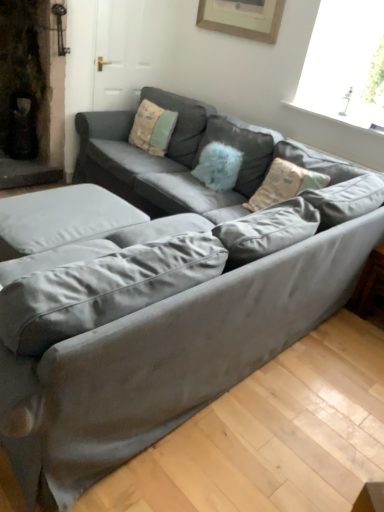
Question: Does satin gray couch at center lie in front of velvet beige pillow at center, which is counted as the 1th pillow, starting from the left?

Choices:
 (A) no
 (B) yes

Answer: (B)

Question: Is velvet beige pillow at center, arranged as the 2th pillow when viewed from the right, a part of satin gray couch at center?

Choices:
 (A) yes
 (B) no

Answer: (A)

Question: From the image's perspective, is satin gray couch at center beneath velvet beige pillow at center, arranged as the 2th pillow when viewed from the right?

Choices:
 (A) yes
 (B) no

Answer: (A)

Question: From the image's perspective, is satin gray couch at center on velvet beige pillow at center, arranged as the 2th pillow when viewed from the right?

Choices:
 (A) yes
 (B) no

Answer: (B)

Question: Can you confirm if satin gray couch at center is smaller than velvet beige pillow at center, arranged as the 2th pillow when viewed from the right?

Choices:
 (A) no
 (B) yes

Answer: (A)

Question: Considering their positions, is satin gray couch at center located in front of or behind velvet beige pillow at center, which is counted as the 1th pillow, starting from the left?

Choices:
 (A) behind
 (B) front

Answer: (B)

Question: From a real-world perspective, is satin gray couch at center positioned above or below velvet beige pillow at center, which is counted as the 1th pillow, starting from the left?

Choices:
 (A) above
 (B) below

Answer: (B)

Question: Is satin gray couch at center bigger or smaller than velvet beige pillow at center, which is counted as the 1th pillow, starting from the left?

Choices:
 (A) big
 (B) small

Answer: (A)

Question: Based on their positions, is satin gray couch at center located to the left or right of velvet beige pillow at center, which is counted as the 1th pillow, starting from the left?

Choices:
 (A) left
 (B) right

Answer: (B)

Question: Is point (380, 279) positioned closer to the camera than point (264, 137)?

Choices:
 (A) closer
 (B) farther

Answer: (A)

Question: In the image, is wooden side table at lower right positioned in front of or behind fluffy blue pillow at center, which is the first pillow from right to left?

Choices:
 (A) behind
 (B) front

Answer: (B)

Question: From the image's perspective, is wooden side table at lower right located above or below fluffy blue pillow at center, which is counted as the second pillow, starting from the left?

Choices:
 (A) below
 (B) above

Answer: (A)

Question: Is wooden side table at lower right bigger or smaller than fluffy blue pillow at center, which is counted as the second pillow, starting from the left?

Choices:
 (A) small
 (B) big

Answer: (A)

Question: From the image's perspective, is wooden side table at lower right above or below velvet beige pillow at center, which is counted as the 1th pillow, starting from the left?

Choices:
 (A) below
 (B) above

Answer: (A)

Question: From a real-world perspective, relative to velvet beige pillow at center, which is counted as the 1th pillow, starting from the left, is wooden side table at lower right vertically above or below?

Choices:
 (A) below
 (B) above

Answer: (A)